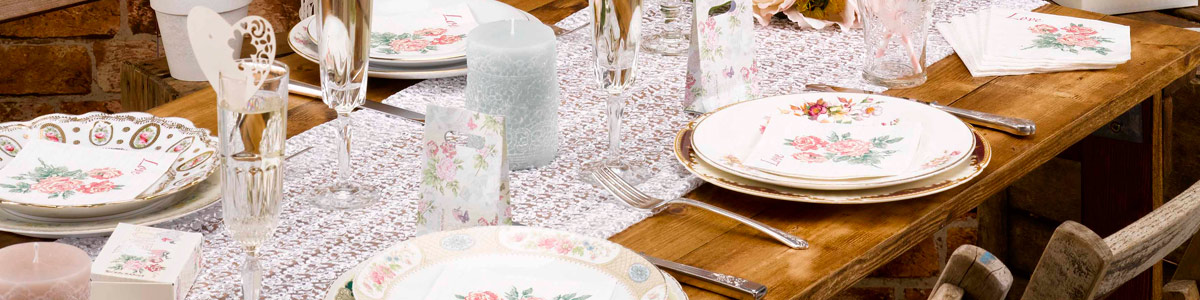
Identify the location of glass. (252, 132), (349, 39), (608, 59), (668, 5), (900, 27).